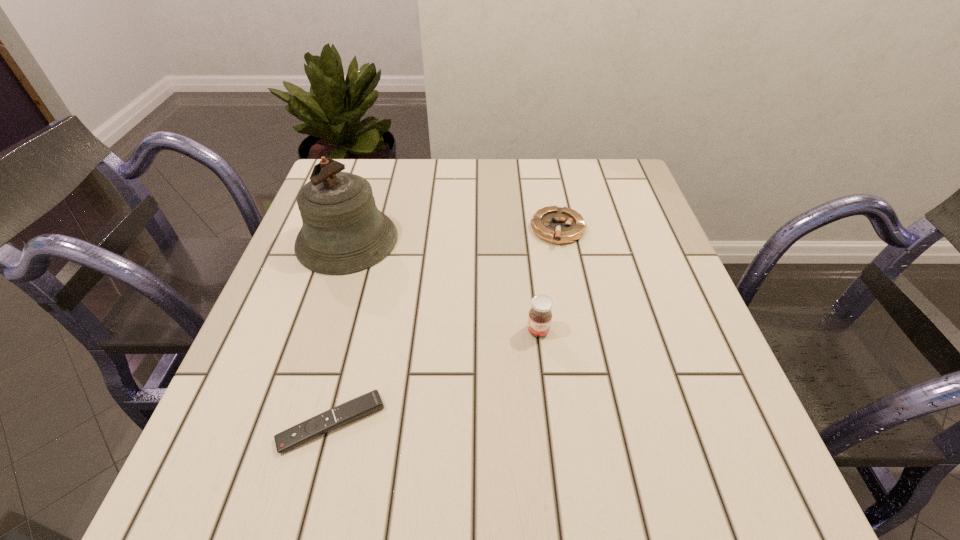
This screenshot has width=960, height=540. Identify the location of bell. (343, 232).

Find the location of a particular element. This screenshot has height=540, width=960. jam is located at coordinates (x=540, y=315).

At what (x,y) coordinates should I click in order to perform the action: click on the third shortest object. Please return your answer as a coordinate pair (x, y). Looking at the image, I should click on (540, 315).

The height and width of the screenshot is (540, 960). What are the coordinates of `the second shortest object` in the screenshot? It's located at (556, 225).

Identify the location of remote control. (371, 402).

Locate an element on the screen. the shortest object is located at coordinates (371, 402).

The width and height of the screenshot is (960, 540). Find the location of `vacant space located 0.120m on the front of the tallest object`. vacant space located 0.120m on the front of the tallest object is located at coordinates click(x=322, y=318).

Find the location of `free space located 0.210m on the label side of the jam`. free space located 0.210m on the label side of the jam is located at coordinates (552, 448).

Find the location of `vacant space located 0.300m on the front of the ashtray`. vacant space located 0.300m on the front of the ashtray is located at coordinates (583, 357).

What are the coordinates of `free space located 0.350m on the right of the nearest object` in the screenshot? It's located at (x=596, y=423).